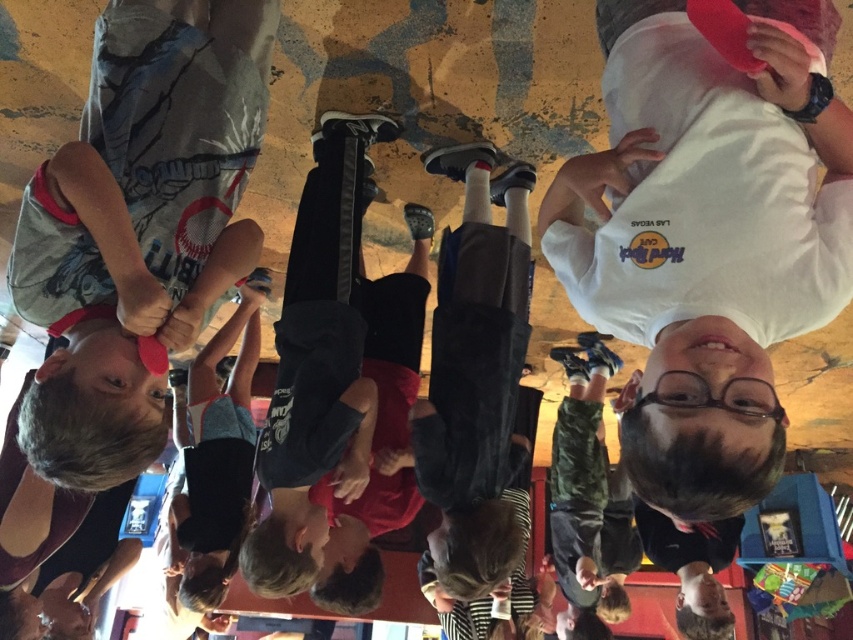
Question: Is dark gray pants at center bigger than camouflage pants at lower right?

Choices:
 (A) no
 (B) yes

Answer: (A)

Question: From the image, what is the correct spatial relationship of dark gray pants at center in relation to camouflage pants at lower right?

Choices:
 (A) right
 (B) left

Answer: (B)

Question: Which of the following is the closest to the observer?

Choices:
 (A) (561, 554)
 (B) (439, 348)

Answer: (B)

Question: Which point is farther from the camera taking this photo?

Choices:
 (A) (573, 570)
 (B) (474, 186)

Answer: (A)

Question: Is dark gray pants at center positioned before camouflage pants at lower right?

Choices:
 (A) yes
 (B) no

Answer: (A)